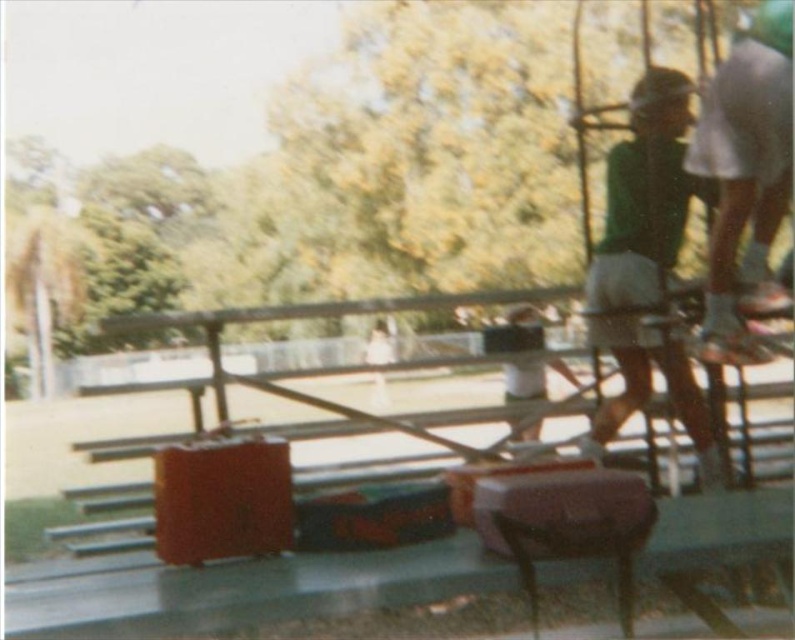
Does green fabric shirt at right appear under green fabric shirt at center?

No.

Is green fabric shirt at right bigger than green fabric shirt at center?

No.

Locate an element on the screen. The width and height of the screenshot is (795, 640). green fabric shirt at right is located at coordinates (642, 195).

Locate an element on the screen. green fabric shirt at right is located at coordinates (642, 195).